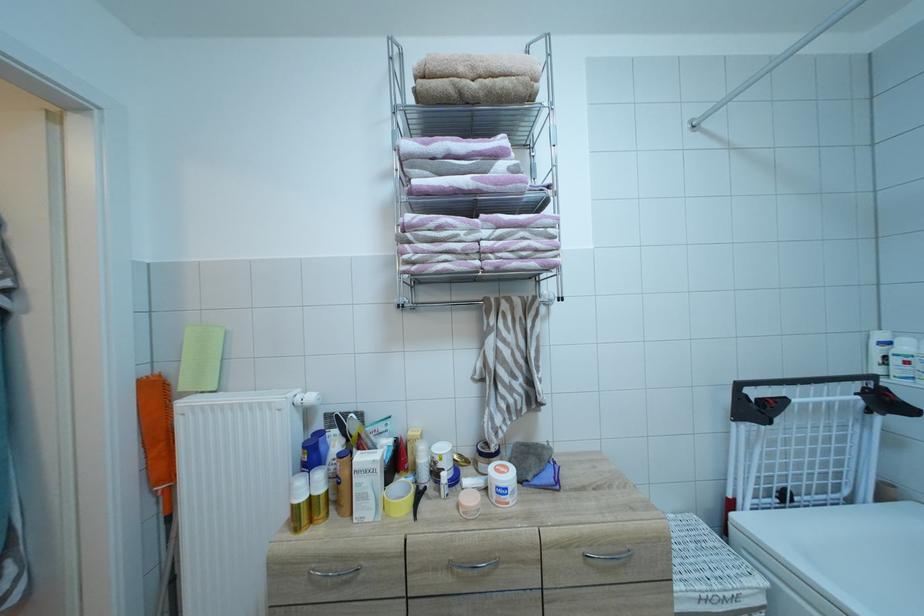
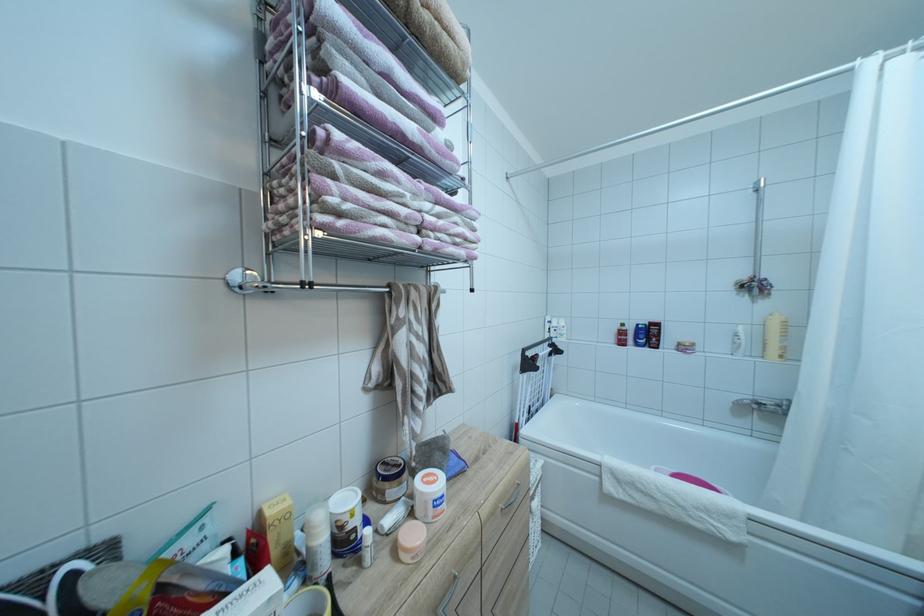
Question: The camera is either moving clockwise (left) or counter-clockwise (right) around the object. The first image is from the beginning of the video and the second image is from the end. Is the camera moving left or right when shooting the video?

Choices:
 (A) Left
 (B) Right

Answer: (A)